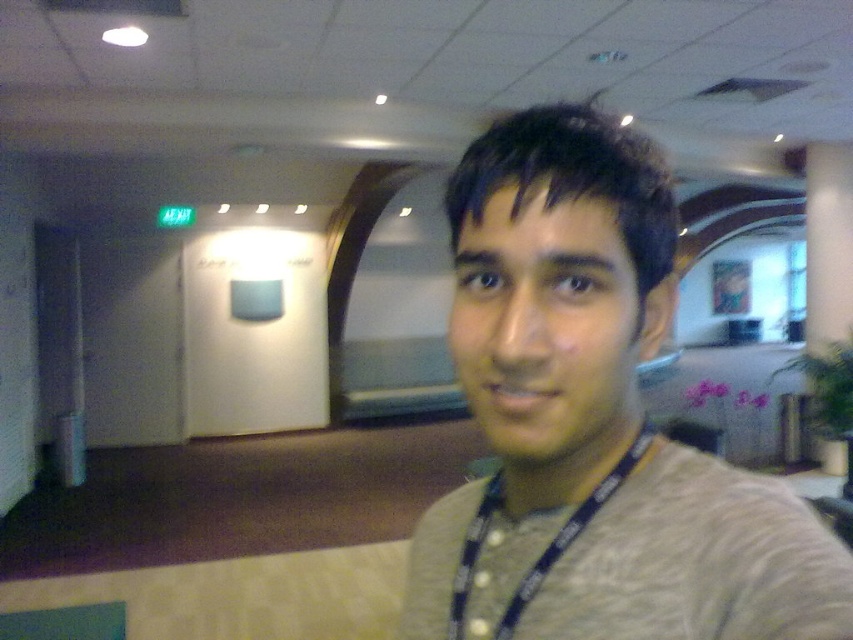
Question: Can you confirm if gray cotton shirt at center is positioned above blue fabric lanyard at center?

Choices:
 (A) yes
 (B) no

Answer: (A)

Question: Does gray cotton shirt at center appear over blue fabric lanyard at center?

Choices:
 (A) no
 (B) yes

Answer: (B)

Question: Among these objects, which one is nearest to the camera?

Choices:
 (A) gray cotton shirt at center
 (B) blue fabric lanyard at center

Answer: (A)

Question: Does gray cotton shirt at center have a greater width compared to blue fabric lanyard at center?

Choices:
 (A) no
 (B) yes

Answer: (B)

Question: Which point is closer to the camera?

Choices:
 (A) blue fabric lanyard at center
 (B) gray cotton shirt at center

Answer: (B)